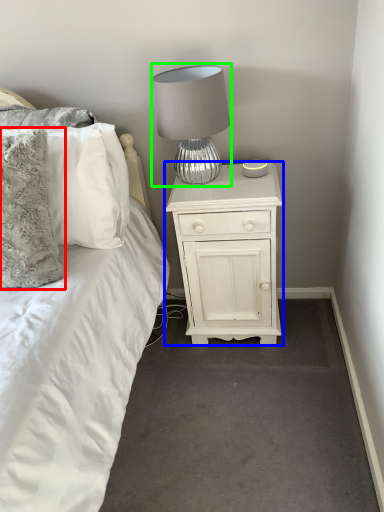
Question: Which object is positioned farthest from pillow (highlighted by a red box)? Select from nightstand (highlighted by a blue box) and lamp (highlighted by a green box).

Choices:
 (A) nightstand
 (B) lamp

Answer: (A)